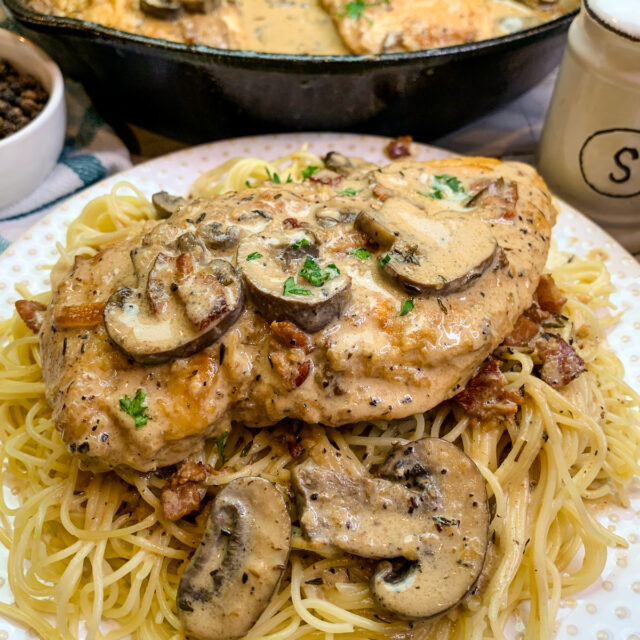
In order to click on white bowl in this screenshot , I will do `click(44, 140)`.